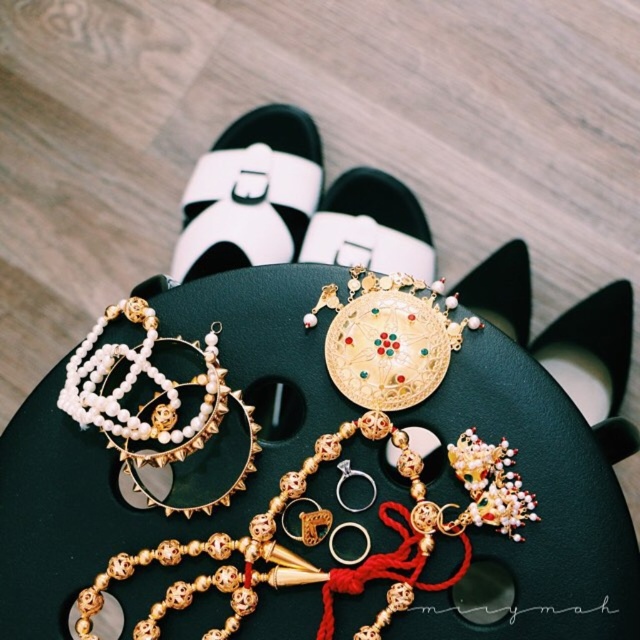
You are a jeweler examining the gold beaded necklace at center and the gold metallic earring at center displayed on the dark green surface. Which of these two items is taller?

The gold beaded necklace at center is taller than the gold metallic earring at center.

You are looking at the scene and want to determine which of the two points, point [404,572] or point [100,419], is nearer to you. Based on the spatial arrangement, which point is closer?

Point [404,572] is closer to the camera than point [100,419], so it is the nearer one.